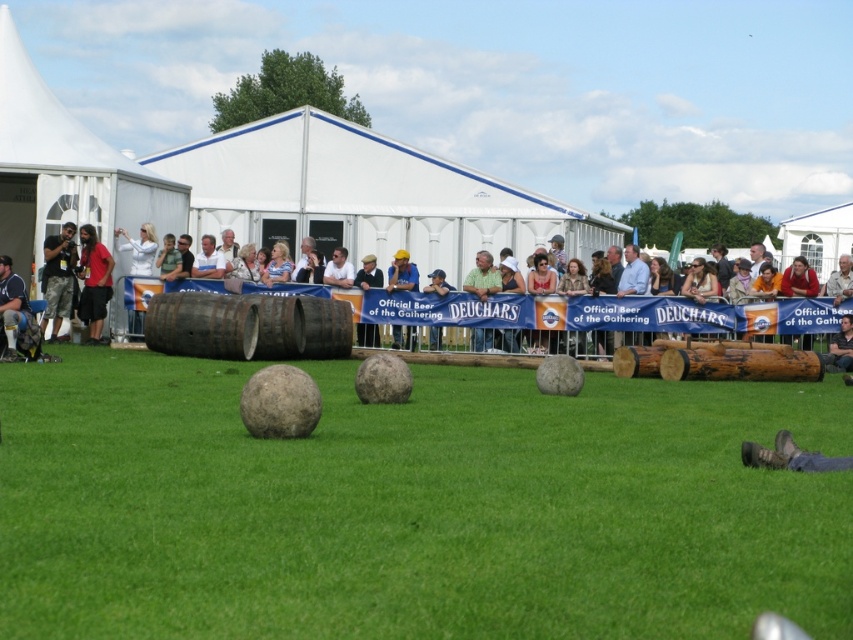
You are planning to set up a small picnic blanket on the green grass at center. However, you also notice the white fabric tent at left nearby. Which area has enough space to accommodate your picnic blanket?

The white fabric tent at left has a larger size compared to the green grass at center, so it can accommodate the picnic blanket better.

You are a photographer trying to capture both the camouflage pants at left and the light brown wooden barrel at center in the same frame. Which object should you zoom in on to ensure both are visible without cropping?

You should zoom in on the camouflage pants at left since it is smaller than the light brown wooden barrel at center, allowing both to fit within the frame.